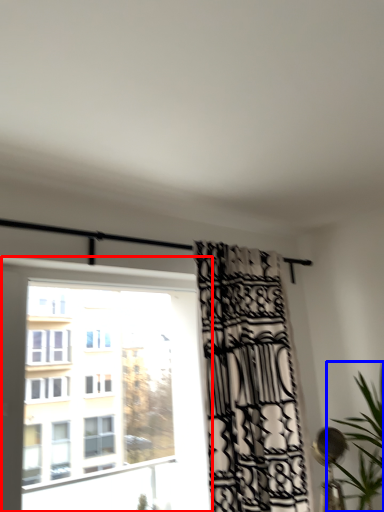
Question: Which of the following is the farthest to the observer, window (highlighted by a red box) or houseplant (highlighted by a blue box)?

Choices:
 (A) window
 (B) houseplant

Answer: (B)